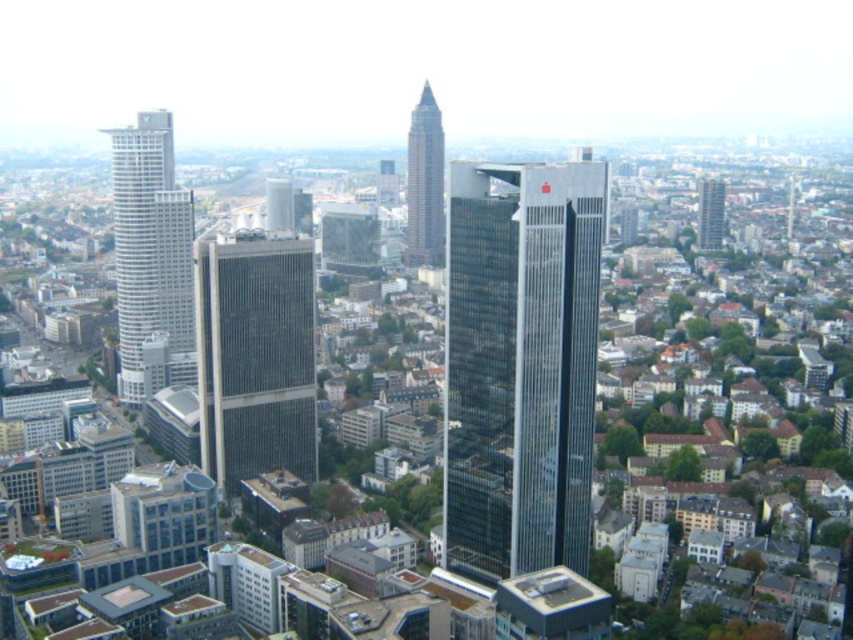
Does white glass skyscraper at left come behind smooth glass skyscraper at center?

That is False.

Is point (144, 131) positioned after point (415, 237)?

That is False.

This screenshot has width=853, height=640. In order to click on white glass skyscraper at left in this screenshot , I will do `click(151, 259)`.

Who is positioned more to the right, smooth glass skyscraper at center or glassy reflective skyscraper at right?

glassy reflective skyscraper at right

Who is lower down, smooth glass skyscraper at center or glassy reflective skyscraper at right?

Positioned lower is glassy reflective skyscraper at right.

Is point (425, 225) behind point (706, 188)?

No, (425, 225) is in front of (706, 188).

Find the location of `smooth glass skyscraper at center`. smooth glass skyscraper at center is located at coordinates (425, 182).

Is point (196, 252) positioned behind point (126, 198)?

No, it is in front of (126, 198).

Where is `dark gray glass skyscraper at center`? dark gray glass skyscraper at center is located at coordinates (254, 355).